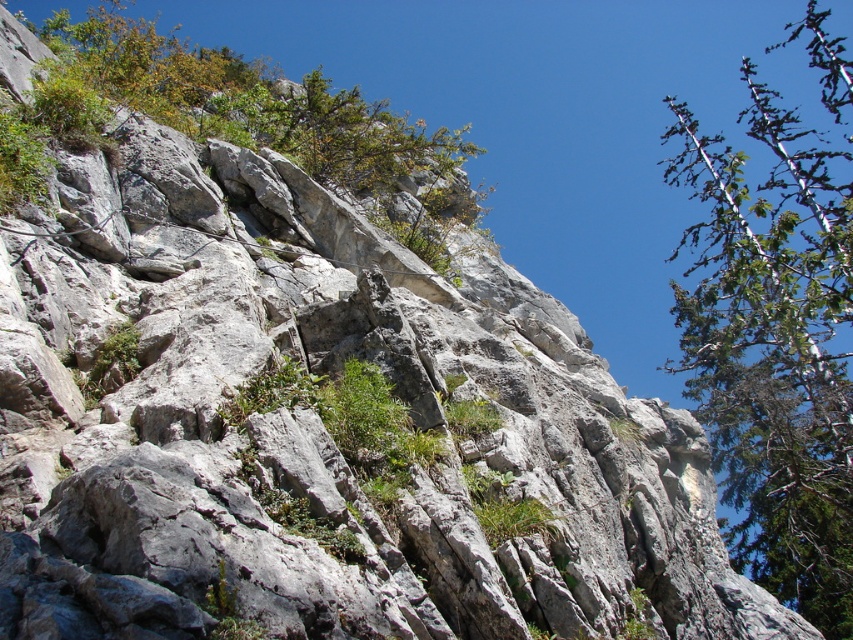
Question: Can you confirm if green leafy tree at upper right is positioned to the right of green leafy tree at upper left?

Choices:
 (A) no
 (B) yes

Answer: (B)

Question: Can you confirm if green leafy tree at upper right is positioned above green leafy tree at upper left?

Choices:
 (A) yes
 (B) no

Answer: (B)

Question: Which point appears farthest from the camera in this image?

Choices:
 (A) (265, 120)
 (B) (712, 147)

Answer: (B)

Question: Among these objects, which one is farthest from the camera?

Choices:
 (A) green leafy tree at upper left
 (B) green leafy tree at upper right

Answer: (B)

Question: Can you confirm if green leafy tree at upper right is thinner than green leafy tree at upper left?

Choices:
 (A) no
 (B) yes

Answer: (A)